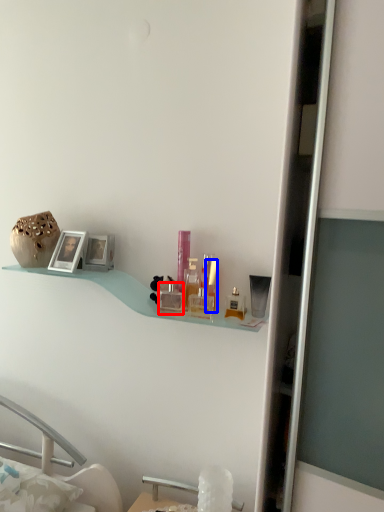
Question: Which object is closer to the camera taking this photo, toiletry (highlighted by a red box) or toiletry (highlighted by a blue box)?

Choices:
 (A) toiletry
 (B) toiletry

Answer: (B)